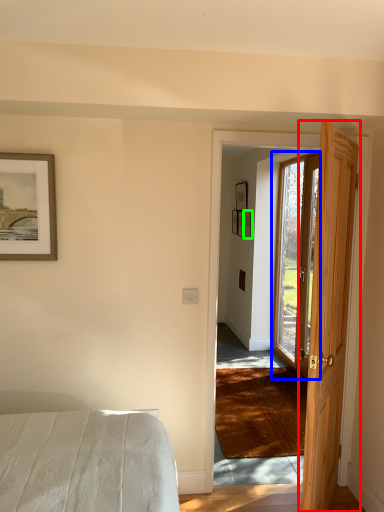
Question: Based on their relative distances, which object is farther from door (highlighted by a red box)? Choose from door (highlighted by a blue box) and picture frame (highlighted by a green box).

Choices:
 (A) door
 (B) picture frame

Answer: (B)